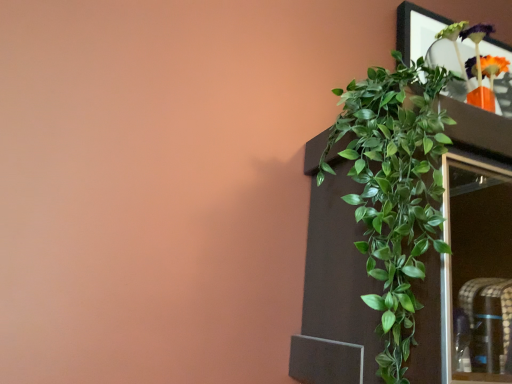
Question: Should I look upward or downward to see green leafy plant at upper right?

Choices:
 (A) down
 (B) up

Answer: (A)